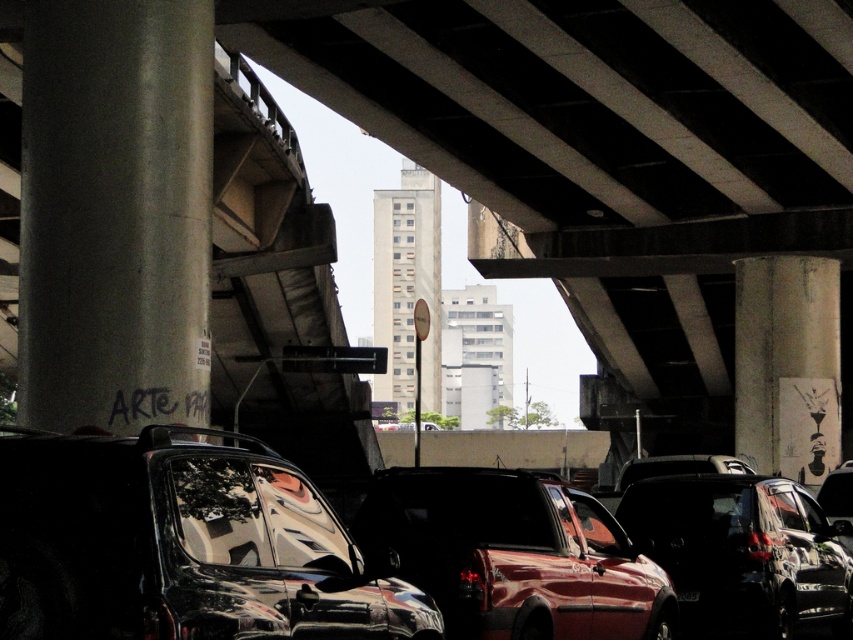
Question: Can you confirm if shiny metallic truck at center is bigger than concrete textured pillar at right?

Choices:
 (A) yes
 (B) no

Answer: (B)

Question: Which object is positioned farthest from the shiny metallic truck at center?

Choices:
 (A) black plastic license plate at center
 (B) glossy metallic car at lower left
 (C) concrete textured pillar at right

Answer: (C)

Question: Is shiny metallic truck at center closer to camera compared to black plastic license plate at center?

Choices:
 (A) yes
 (B) no

Answer: (A)

Question: Which object appears farthest from the camera in this image?

Choices:
 (A) concrete pillar at left
 (B) shiny metallic truck at center
 (C) black plastic license plate at center

Answer: (C)

Question: Can you confirm if concrete pillar at left is smaller than glossy metallic car at lower left?

Choices:
 (A) yes
 (B) no

Answer: (B)

Question: Among these points, which one is farthest from the camera?

Choices:
 (A) (795, 312)
 (B) (682, 593)

Answer: (A)